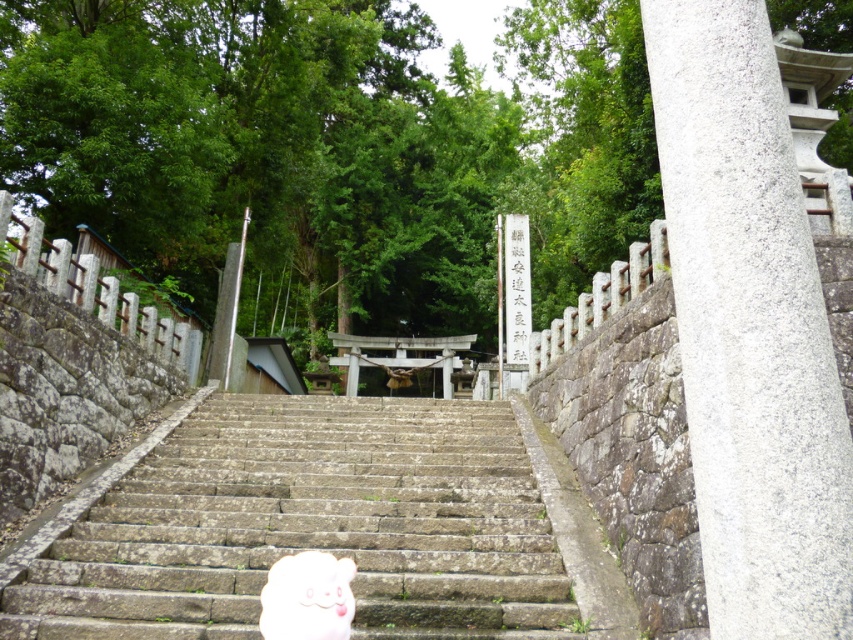
Can you confirm if gray stone pillar at right is positioned to the left of white plush toy at center?

No, gray stone pillar at right is not to the left of white plush toy at center.

Locate an element on the screen. gray stone pillar at right is located at coordinates (749, 328).

I want to click on gray stone pillar at right, so click(x=749, y=328).

Can you confirm if stone stairs at center is positioned below gray stone pillar at right?

Indeed, stone stairs at center is positioned under gray stone pillar at right.

Consider the image. Does stone stairs at center lie behind gray stone pillar at right?

That is True.

Which is in front, point (225, 563) or point (793, 310)?

Positioned in front is point (793, 310).

Where is `stone stairs at center`? The height and width of the screenshot is (640, 853). stone stairs at center is located at coordinates (311, 525).

Which of these two, stone stairs at center or white plush toy at center, stands taller?

With more height is white plush toy at center.

In the scene shown: Is stone stairs at center in front of white plush toy at center?

No, it is not.

Find the location of a particular element. Image resolution: width=853 pixels, height=640 pixels. stone stairs at center is located at coordinates (311, 525).